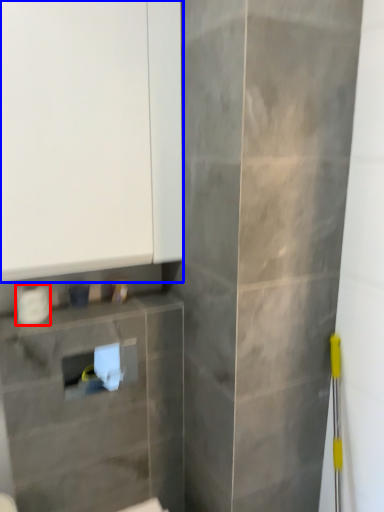
Question: Which object appears farthest to the camera in this image, toilet paper (highlighted by a red box) or cabinetry (highlighted by a blue box)?

Choices:
 (A) toilet paper
 (B) cabinetry

Answer: (A)